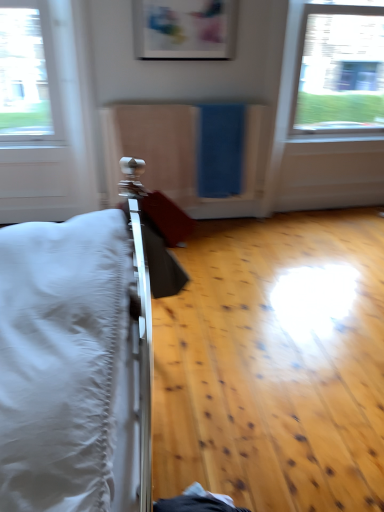
Describe the element at coordinates (184, 29) in the screenshot. The height and width of the screenshot is (512, 384). I see `matte plastic picture frame at upper center` at that location.

Where is `matte plastic picture frame at upper center`? matte plastic picture frame at upper center is located at coordinates (184, 29).

Identify the location of matte plastic picture frame at upper center. The width and height of the screenshot is (384, 512). click(x=184, y=29).